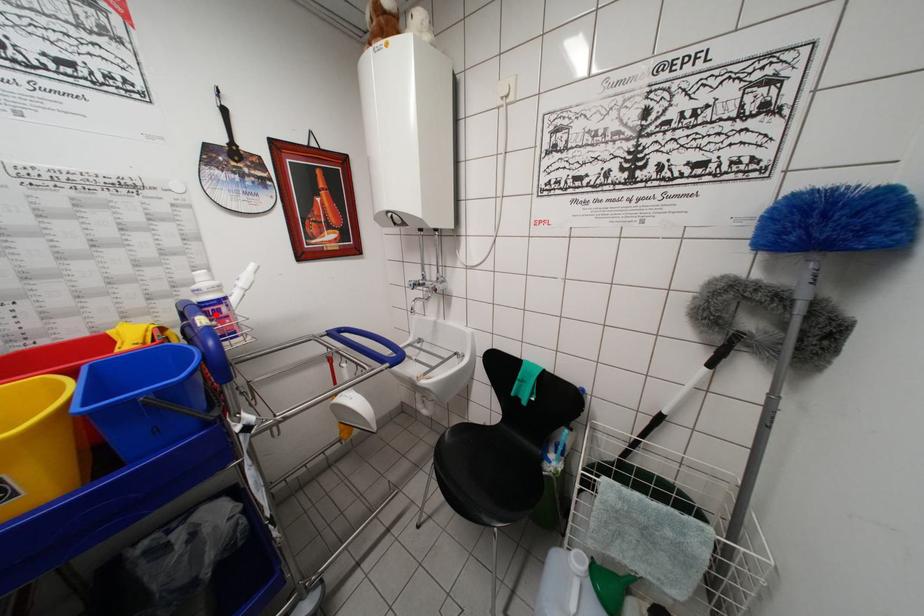
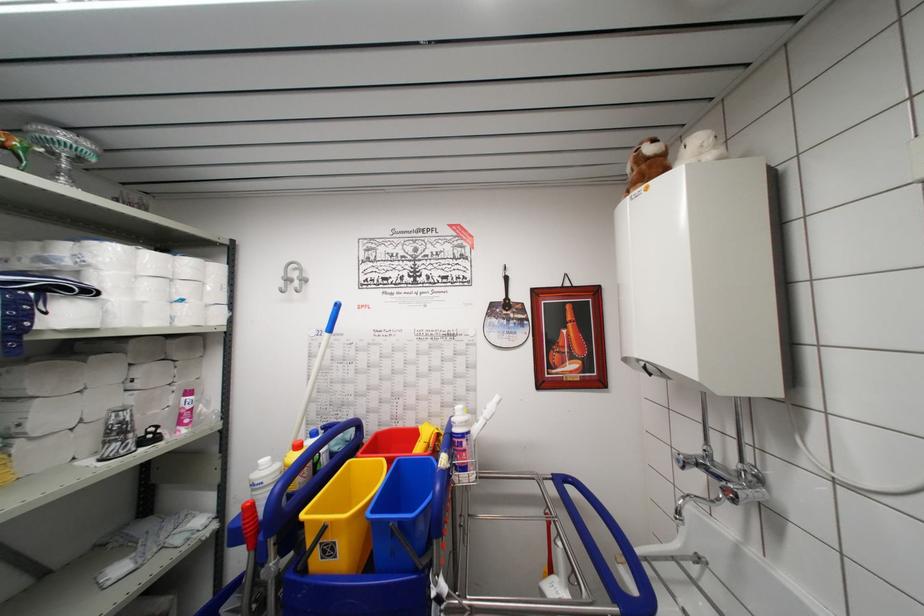
Find the pixel in the second image that matches the highlighted location in the first image.

(460, 447)